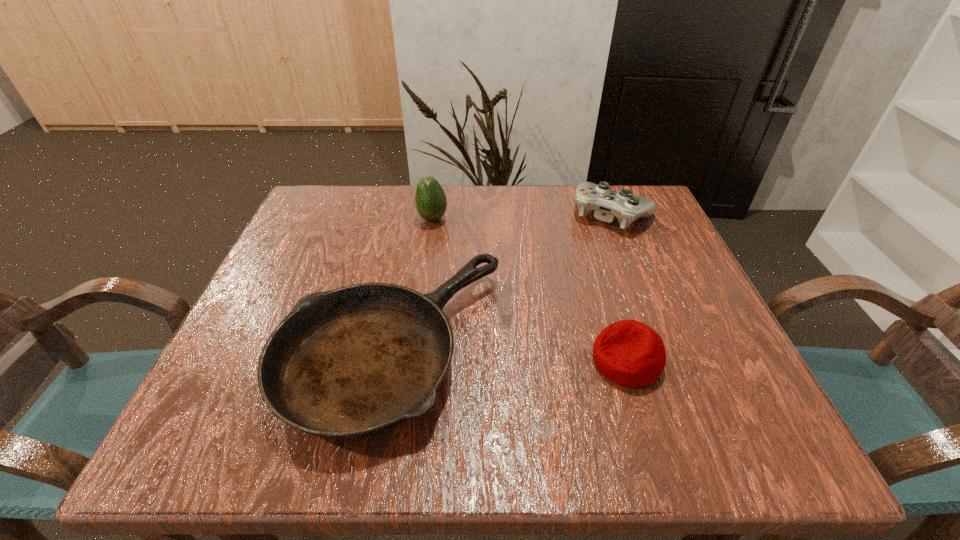
Locate an element on the screen. The image size is (960, 540). free spot between the shortest object and the avocado is located at coordinates (412, 283).

Identify the location of free spot between the beanbag and the shortest object. (509, 354).

Where is `vacant point located between the third tallest object and the shortest object`? The width and height of the screenshot is (960, 540). vacant point located between the third tallest object and the shortest object is located at coordinates (509, 354).

I want to click on vacant space in between the control and the avocado, so click(x=522, y=216).

You are a GUI agent. You are given a task and a screenshot of the screen. Output one action in this format:
    pyautogui.click(x=<x>, y=<y>)
    Task: Click on the object that is the third closest one to the control
    This screenshot has width=960, height=540.
    Given the screenshot: What is the action you would take?
    pyautogui.click(x=430, y=199)

Find the location of a particular element. The image size is (960, 540). object that is the third closest to the avocado is located at coordinates (630, 353).

Find the location of a particular element. This screenshot has width=960, height=540. vacant area that satisfies the following two spatial constraints: 1. on the back side of the control; 2. on the right side of the avocado is located at coordinates (433, 213).

Where is `vacant space that satisfies the following two spatial constraints: 1. on the back side of the control; 2. on the right side of the avocado`? The height and width of the screenshot is (540, 960). vacant space that satisfies the following two spatial constraints: 1. on the back side of the control; 2. on the right side of the avocado is located at coordinates (433, 213).

In order to click on blank space that satisfies the following two spatial constraints: 1. on the back side of the shortest object; 2. on the right side of the control in this screenshot , I will do `click(417, 213)`.